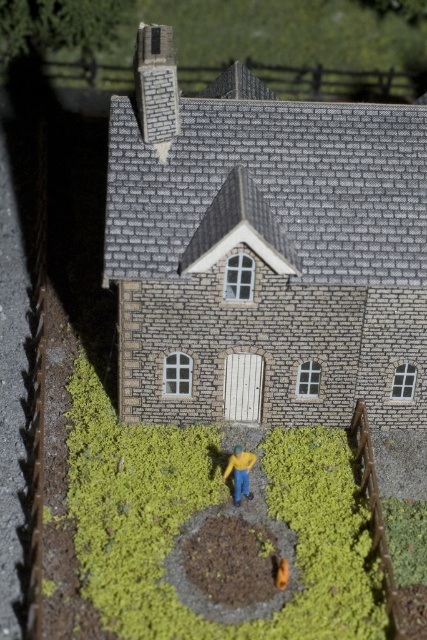
Does yellow matte jacket at center appear over orange matte toy at center?

Indeed, yellow matte jacket at center is positioned over orange matte toy at center.

Who is taller, yellow matte jacket at center or orange matte toy at center?

Standing taller between the two is yellow matte jacket at center.

What do you see at coordinates (239, 472) in the screenshot?
I see `yellow matte jacket at center` at bounding box center [239, 472].

Where is `yellow matte jacket at center`? The width and height of the screenshot is (427, 640). yellow matte jacket at center is located at coordinates coord(239,472).